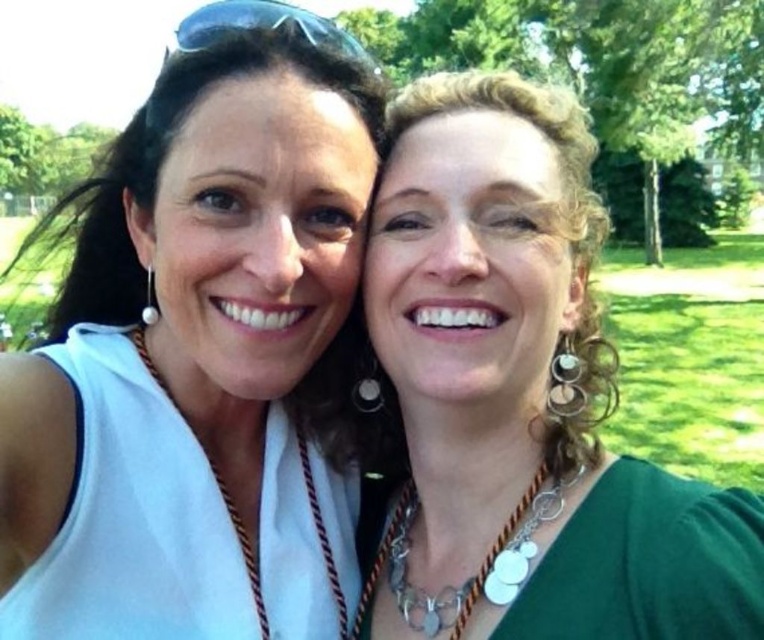
You are a photographer adjusting the focus on your camera. You want to ensure both the green matte necklace at center and the silver metallic chain at center are clearly visible. Since one is larger than the other, which necklace should you focus on first to ensure proper depth of field?

The green matte necklace at center is bigger than the silver metallic chain at center, so you should focus on the green matte necklace at center first to ensure proper depth of field.